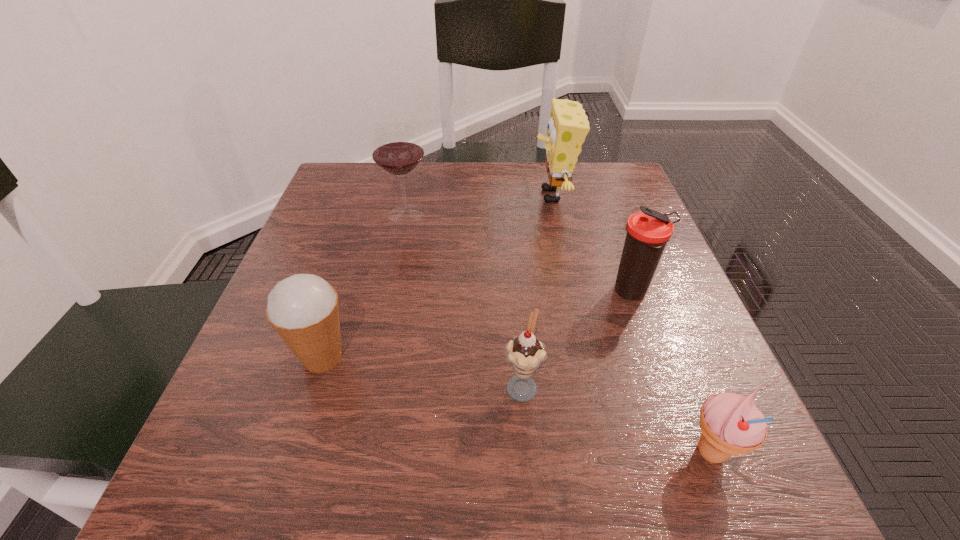
Where is `free space located 0.270m on the right of the wineglass`? Image resolution: width=960 pixels, height=540 pixels. free space located 0.270m on the right of the wineglass is located at coordinates (548, 214).

Locate an element on the screen. vacant space located on the back of the third farthest object is located at coordinates (617, 251).

The image size is (960, 540). In order to click on vacant space situated 0.200m on the back of the leftmost icecream in this screenshot , I will do `click(354, 258)`.

Image resolution: width=960 pixels, height=540 pixels. What are the coordinates of `free space located 0.100m on the front of the second icecream from left to right` in the screenshot? It's located at (529, 474).

This screenshot has width=960, height=540. In order to click on blank area located 0.080m on the back of the nearest icecream in this screenshot , I will do [x=682, y=379].

I want to click on sponge that is at the far edge, so click(567, 128).

Find the location of a particular element. This screenshot has height=540, width=960. wineglass positioned at the far edge is located at coordinates tap(397, 149).

The image size is (960, 540). I want to click on object that is at the near edge, so click(731, 424).

The image size is (960, 540). I want to click on wineglass located in the left edge section of the desktop, so click(397, 149).

Locate an element on the screen. This screenshot has width=960, height=540. icecream that is at the left edge is located at coordinates (303, 309).